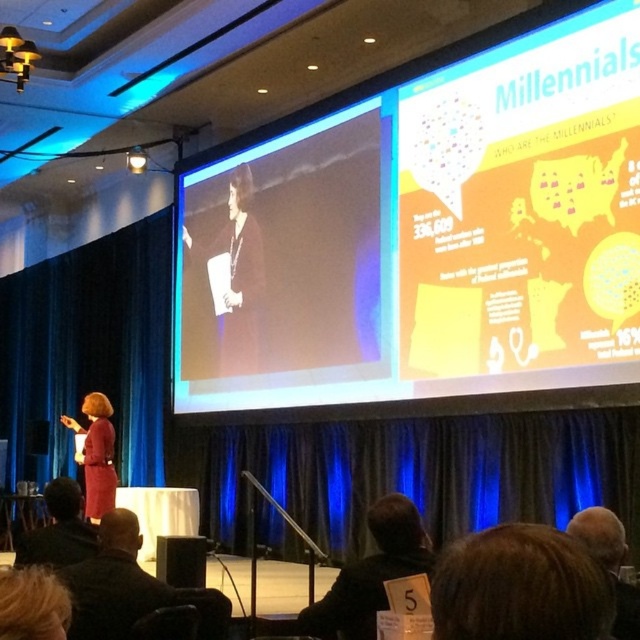
You are an attendee sitting in the front row of the conference hall. You notice two points on the large screen during the presentation. The first point is at coordinates point (77, 529) and the second is at point (172, 573). From your perspective, which point appears closer to you?

Point (77, 529) is in front of point (172, 573), so it appears closer to you.

You are a stagehand preparing to adjust the lighting for the presentation. You need to position a spotlight that has a maximum reach of 20 feet. Can you illuminate the matte black screen at upper center from the dark suit at lower left without moving the spotlight?

The matte black screen at upper center is 20.50 feet away from the dark suit at lower left. Since the spotlight has a maximum reach of 20 feet, it cannot reach the screen from that position. The spotlight needs to be moved closer to achieve proper illumination.

You are a speaker in the conference hall and you need to adjust the projector to focus on a specific point. You have two points to choose from on the screen. The first point is at coordinates point (298, 376) and the second is at point (125, 625). Which point is closer to the front of the screen?

Point (125, 625) is closer to the front of the screen because it is in front of point (298, 376).